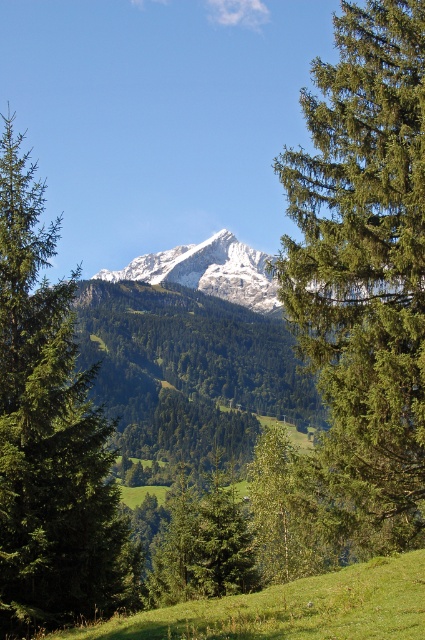
Question: Which point is farther to the camera?

Choices:
 (A) (x=73, y=481)
 (B) (x=306, y=333)

Answer: (B)

Question: Does green needle-like at center have a smaller size compared to green matte tree at center?

Choices:
 (A) no
 (B) yes

Answer: (B)

Question: Which object appears farthest from the camera in this image?

Choices:
 (A) green needle-like at center
 (B) green matte tree at center

Answer: (B)

Question: Is the position of green needle-like at center more distant than that of green matte tree at center?

Choices:
 (A) yes
 (B) no

Answer: (B)

Question: Is green needle-like at center bigger than green matte tree at center?

Choices:
 (A) yes
 (B) no

Answer: (B)